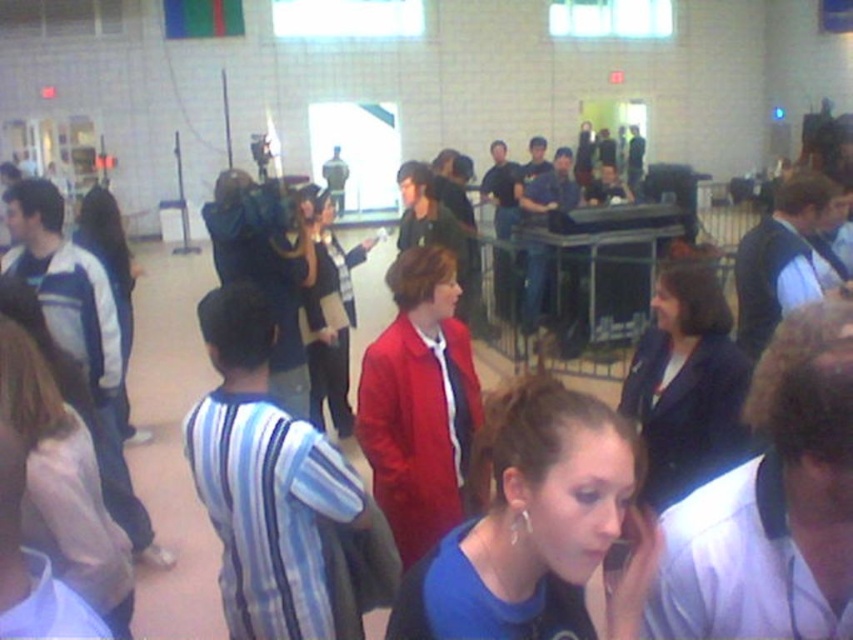
You are an event organizer at the venue and need to arrange seating based on the attendees clothing. You see the matte black blazer at center and the white fleece jacket at left. Which clothing item is positioned lower in the image?

The matte black blazer at center is located below the white fleece jacket at left, so it is positioned lower in the image.

You are standing in the crowded indoor setting and want to see the person wearing the white fleece jacket at left. Is the matte black blazer at center blocking your view of them?

The matte black blazer at center is in front of the white fleece jacket at left, so it is blocking your view of them.